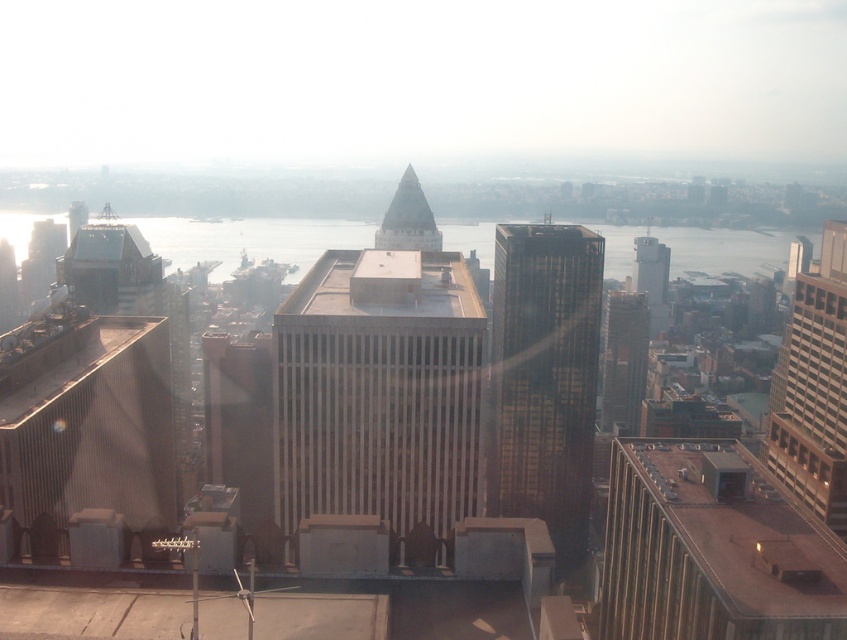
Between glassy reflective skyscraper at center and shiny glass spire at center, which one is positioned lower?

glassy reflective skyscraper at center

Locate an element on the screen. glassy reflective skyscraper at center is located at coordinates (624, 360).

This screenshot has width=847, height=640. I want to click on glassy reflective skyscraper at center, so click(624, 360).

In the scene shown: Which of these two, dark glass skyscraper at center or glassy reflective skyscraper at center, stands shorter?

Standing shorter between the two is glassy reflective skyscraper at center.

Can you confirm if dark glass skyscraper at center is taller than glassy reflective skyscraper at center?

Indeed, dark glass skyscraper at center has a greater height compared to glassy reflective skyscraper at center.

Identify the location of dark glass skyscraper at center. (544, 376).

Which is in front, point (367, 381) or point (626, 406)?

Point (367, 381) is more forward.

Which is more to the left, brown textured building at center or glassy reflective skyscraper at center?

brown textured building at center is more to the left.

Between point (416, 508) and point (621, 392), which one is positioned in front?

Point (416, 508) is more forward.

I want to click on brown textured building at center, so click(379, 390).